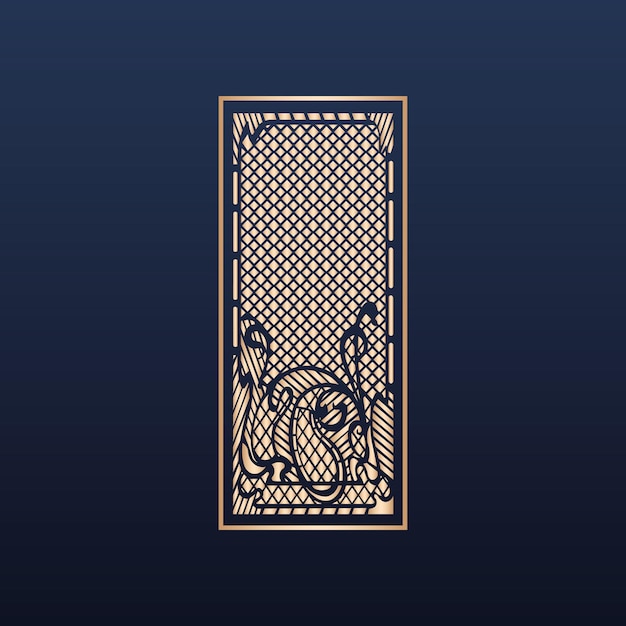
This screenshot has height=626, width=626. I want to click on gold border, so click(x=282, y=99).